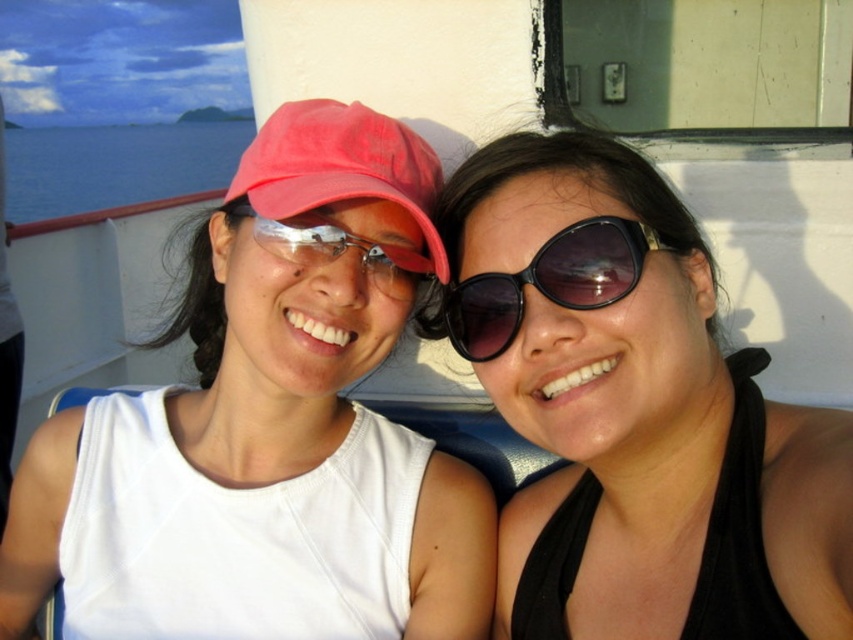
Question: Does black matte sunglasses at center have a lesser width compared to matte red cap at center?

Choices:
 (A) yes
 (B) no

Answer: (B)

Question: Which object is the farthest from the black matte sunglasses at center?

Choices:
 (A) matte red cap at center
 (B) black plastic sunglasses at center
 (C) matte white tank top at center
 (D) matte plastic goggles at center

Answer: (D)

Question: Which object appears closest to the camera in this image?

Choices:
 (A) matte white tank top at center
 (B) blue water at left
 (C) matte red cap at center

Answer: (C)

Question: Is matte white tank top at center to the right of matte red cap at center from the viewer's perspective?

Choices:
 (A) no
 (B) yes

Answer: (A)

Question: Considering the real-world distances, which object is farthest from the matte red cap at center?

Choices:
 (A) matte white tank top at center
 (B) black plastic sunglasses at center

Answer: (B)

Question: Where is matte white tank top at center located in relation to blue water at left in the image?

Choices:
 (A) left
 (B) right

Answer: (B)